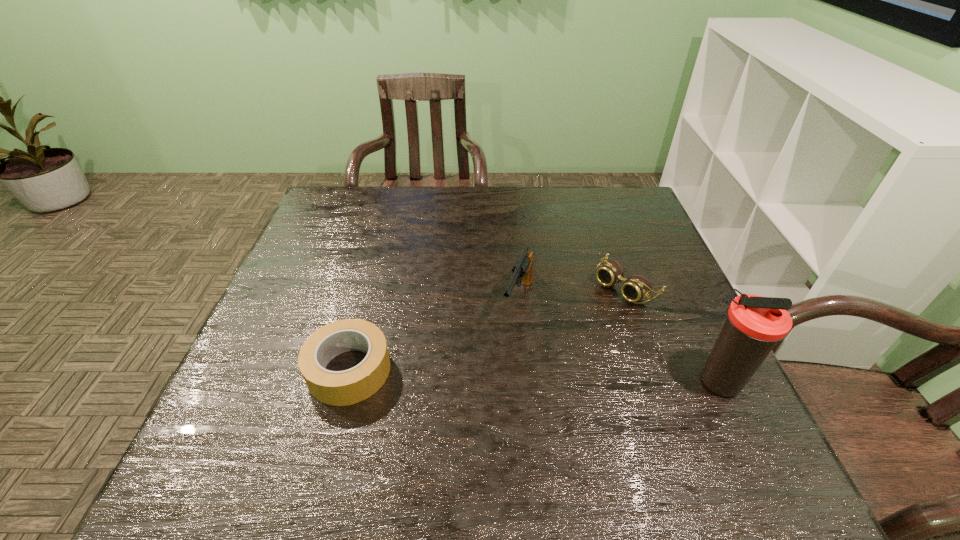
Locate an element on the screen. duct tape is located at coordinates (337, 388).

Find the location of a particular element. thermos bottle is located at coordinates (754, 324).

This screenshot has height=540, width=960. In order to click on goggles in this screenshot , I will do `click(635, 288)`.

Find the location of a particular element. The image size is (960, 540). the second object from left to right is located at coordinates (522, 270).

This screenshot has height=540, width=960. In order to click on gun in this screenshot , I will do `click(522, 270)`.

The image size is (960, 540). I want to click on free spot located at the edge of the leftmost object, so click(x=270, y=370).

Find the location of a particular element. This screenshot has height=540, width=960. vacant space located 0.100m at the edge of the leftmost object is located at coordinates (255, 370).

Locate an element on the screen. Image resolution: width=960 pixels, height=540 pixels. vacant space situated on the left of the tallest object is located at coordinates (555, 381).

This screenshot has width=960, height=540. What are the coordinates of `free location located 0.130m through the lenses of the goggles` in the screenshot? It's located at click(x=573, y=327).

Locate an element on the screen. This screenshot has width=960, height=540. vacant space located 0.380m through the lenses of the goggles is located at coordinates (495, 388).